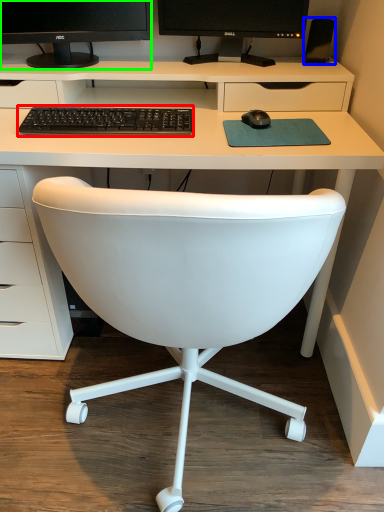
Question: Which object is the farthest from computer keyboard (highlighted by a red box)? Choose among these: speaker (highlighted by a blue box) or computer monitor (highlighted by a green box).

Choices:
 (A) speaker
 (B) computer monitor

Answer: (A)